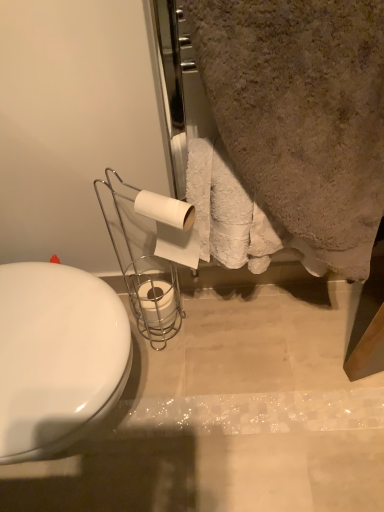
Question: From a real-world perspective, is white glossy toilet at left positioned above or below white matte toilet paper at center, which appears as the second toilet paper when viewed from the back?

Choices:
 (A) above
 (B) below

Answer: (B)

Question: In terms of width, does white glossy toilet at left look wider or thinner when compared to white matte toilet paper at center, positioned as the 1th toilet paper in top-to-bottom order?

Choices:
 (A) thin
 (B) wide

Answer: (B)

Question: Estimate the real-world distances between objects in this image. Which object is closer to the white matte toilet paper at center, positioned as the second toilet paper in bottom-to-top order?

Choices:
 (A) white matte toilet paper at center, which appears as the first toilet paper when ordered from the bottom
 (B) white glossy toilet at left
 (C) beige textured towel at upper right

Answer: (C)

Question: Estimate the real-world distances between objects in this image. Which object is closer to the beige textured towel at upper right?

Choices:
 (A) white glossy toilet at left
 (B) white matte toilet paper at center, which is the first toilet paper from front to back
 (C) white matte toilet paper at center, the 1th toilet paper from the back

Answer: (B)